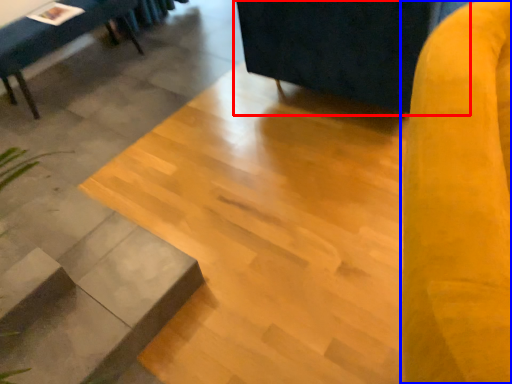
Question: Which object appears closest to the camera in this image, swivel chair (highlighted by a red box) or swivel chair (highlighted by a blue box)?

Choices:
 (A) swivel chair
 (B) swivel chair

Answer: (B)